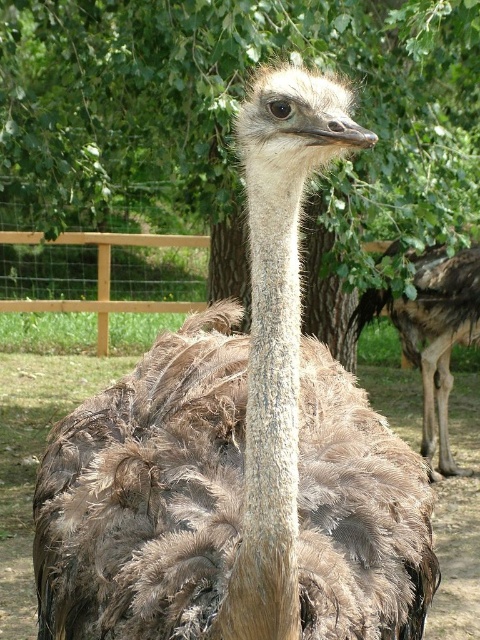
Question: Does green leafy tree at center appear under brown feathered ostrich at center?

Choices:
 (A) no
 (B) yes

Answer: (A)

Question: Which of the following is the closest to the observer?

Choices:
 (A) green leafy tree at center
 (B) brown feathered ostrich at center

Answer: (A)

Question: Among these points, which one is nearest to the camera?

Choices:
 (A) (339, 225)
 (B) (439, 248)

Answer: (A)

Question: Which of the following is the farthest from the observer?

Choices:
 (A) brown feathered ostrich at center
 (B) green leafy tree at center

Answer: (A)

Question: Can you confirm if green leafy tree at center is positioned to the left of brown feathered ostrich at center?

Choices:
 (A) no
 (B) yes

Answer: (B)

Question: Is green leafy tree at center thinner than brown feathered ostrich at center?

Choices:
 (A) no
 (B) yes

Answer: (A)